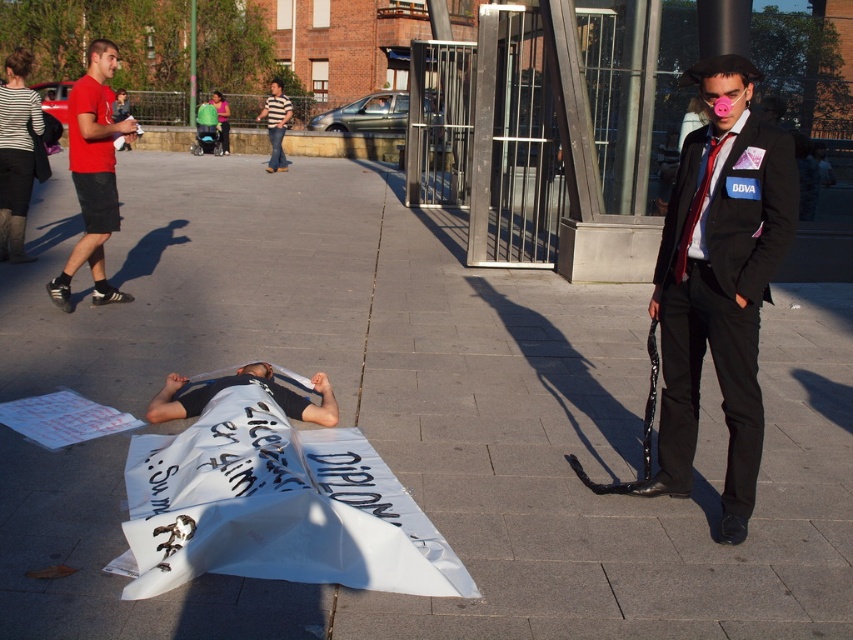
You are a security guard in the plaza. You see a person in a black suit at right and a red silk tie at right. Which item is closer to you?

The black suit at right is closer to the viewer than the red silk tie at right.

You are a security guard in the plaza and need to identify which of the two individuals is closer to the entrance. The entrance is located at the far end of the plaza near the modern building. Use the sizes of the black suit at right and striped fabric shirt at upper center to determine proximity. Which individual is closer?

The black suit at right is smaller than the striped fabric shirt at upper center. Since objects closer to the viewer appear larger, the striped fabric shirt at upper center is closer to the entrance, which is at the far end near the modern building. Therefore, the individual in the black suit at right is farther away, making the striped fabric shirt at upper center closer to the entrance.